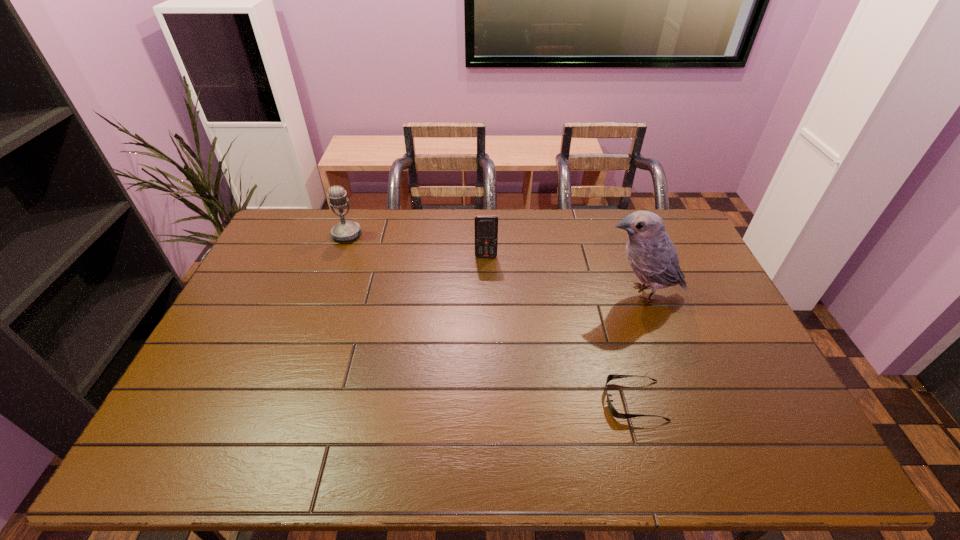
Where is `unoccupied position between the nearest object and the second object from left to right`? This screenshot has height=540, width=960. unoccupied position between the nearest object and the second object from left to right is located at coordinates (561, 328).

Locate an element on the screen. free space between the microphone and the tallest object is located at coordinates (493, 265).

The height and width of the screenshot is (540, 960). Find the location of `object identified as the third closest to the cellular telephone`. object identified as the third closest to the cellular telephone is located at coordinates (610, 377).

Identify which object is the third closest to the third shortest object. Please provide its 2D coordinates. Your answer should be formatted as a tuple, i.e. [(x, y)], where the tuple contains the x and y coordinates of a point satisfying the conditions above.

[(610, 377)]